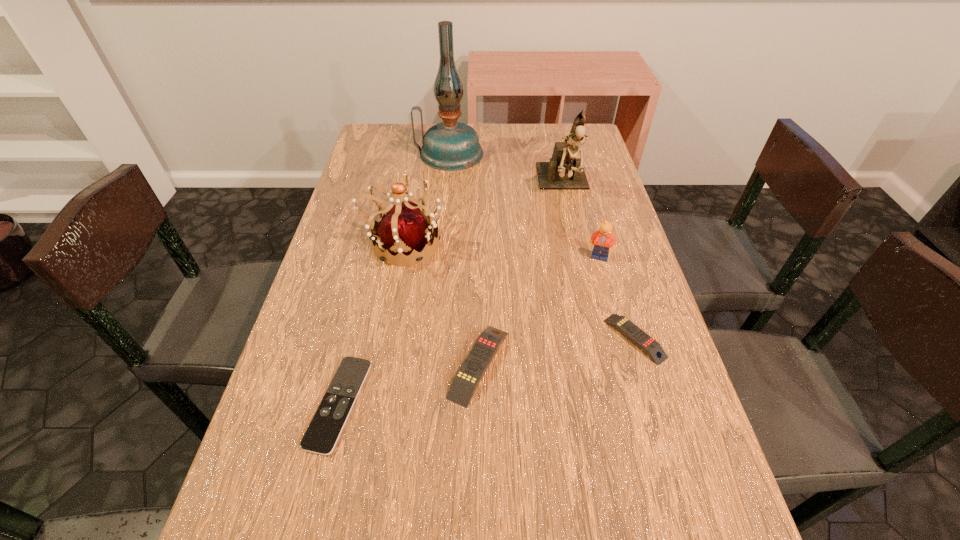
At what (x,y) coordinates should I click in order to perform the action: click on remote control identified as the third closest to the Lego. Please return your answer as a coordinate pair (x, y). The width and height of the screenshot is (960, 540). Looking at the image, I should click on (328, 422).

Identify which remote control is the third closest to the fourth shortest object. Please provide its 2D coordinates. Your answer should be formatted as a tuple, i.e. [(x, y)], where the tuple contains the x and y coordinates of a point satisfying the conditions above.

[(328, 422)]

This screenshot has width=960, height=540. In order to click on free space that satisfies the following two spatial constraints: 1. on the back side of the tallest remote control; 2. on the left side of the right yellow remote control in this screenshot , I will do `click(479, 339)`.

The image size is (960, 540). I want to click on vacant space that satisfies the following two spatial constraints: 1. on the front side of the tallest remote control; 2. on the left side of the tallest object, so click(x=430, y=364).

Locate an element on the screen. This screenshot has width=960, height=540. vacant area in the image that satisfies the following two spatial constraints: 1. on the front-facing side of the brown figurine; 2. on the front-facing side of the tiara is located at coordinates (577, 244).

Where is `vacant point that satisfies the following two spatial constraints: 1. on the front-facing side of the brown figurine; 2. on the front-facing side of the fifth shortest object`? This screenshot has width=960, height=540. vacant point that satisfies the following two spatial constraints: 1. on the front-facing side of the brown figurine; 2. on the front-facing side of the fifth shortest object is located at coordinates (577, 244).

Locate an element on the screen. Image resolution: width=960 pixels, height=540 pixels. vacant point that satisfies the following two spatial constraints: 1. on the front-facing side of the fifth shortest object; 2. on the left side of the second shortest remote control is located at coordinates (386, 339).

Image resolution: width=960 pixels, height=540 pixels. In order to click on vacant region that satisfies the following two spatial constraints: 1. on the front-facing side of the fifth shortest object; 2. on the back side of the left yellow remote control in this screenshot , I will do `click(381, 364)`.